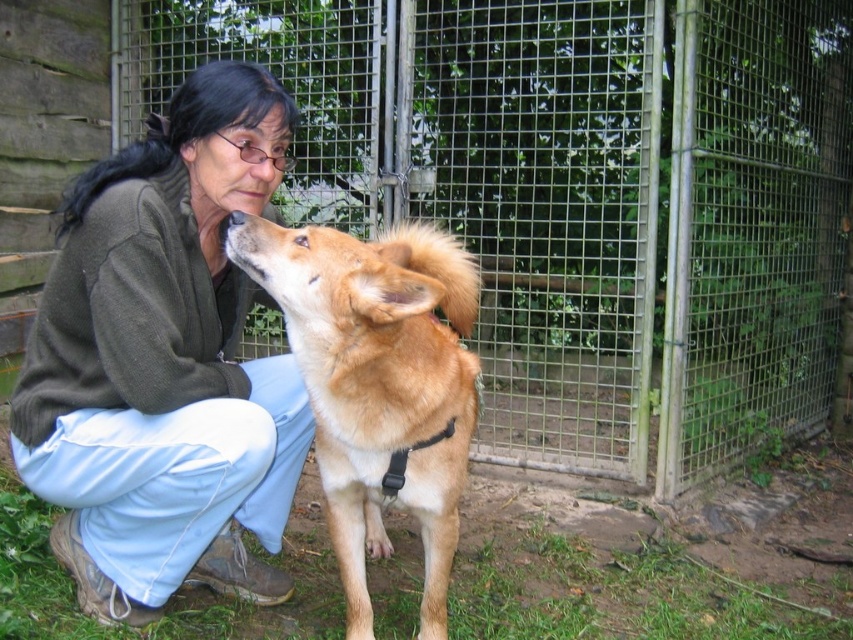
This screenshot has width=853, height=640. What do you see at coordinates (577, 195) in the screenshot?
I see `green wire mesh fence at center` at bounding box center [577, 195].

Can you confirm if green wire mesh fence at center is shorter than fuzzy brown dog at center?

No, green wire mesh fence at center is not shorter than fuzzy brown dog at center.

Is point (502, 353) farther from viewer compared to point (415, 500)?

Yes, point (502, 353) is behind point (415, 500).

Image resolution: width=853 pixels, height=640 pixels. Identify the location of green wire mesh fence at center. (577, 195).

Is green wire mesh fence at center in front of matte green sweater at center?

That is False.

Does green wire mesh fence at center appear on the left side of matte green sweater at center?

Incorrect, green wire mesh fence at center is not on the left side of matte green sweater at center.

Between point (248, 339) and point (13, 426), which one is positioned in front?

Point (13, 426) is in front.

Where is `green wire mesh fence at center`? The image size is (853, 640). green wire mesh fence at center is located at coordinates (577, 195).

Who is higher up, matte green sweater at center or fuzzy brown dog at center?

matte green sweater at center is higher up.

Which of these two, matte green sweater at center or fuzzy brown dog at center, stands shorter?

Standing shorter between the two is fuzzy brown dog at center.

Is point (169, 266) farther from viewer compared to point (436, 637)?

No, (169, 266) is in front of (436, 637).

Locate an element on the screen. This screenshot has width=853, height=640. matte green sweater at center is located at coordinates (x=164, y=362).